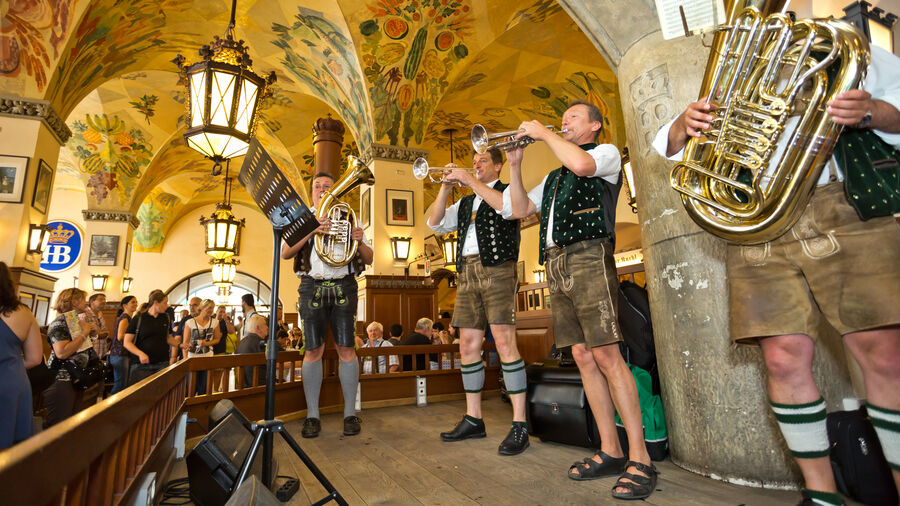
The height and width of the screenshot is (506, 900). Identify the location of wall light. (74, 281), (99, 284), (122, 286), (396, 246), (537, 276).